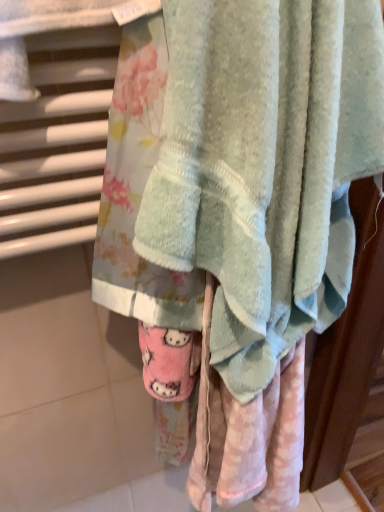
The width and height of the screenshot is (384, 512). What do you see at coordinates (265, 166) in the screenshot?
I see `soft pastel towel at center` at bounding box center [265, 166].

Image resolution: width=384 pixels, height=512 pixels. Identify the location of soft pastel towel at center. (265, 166).

This screenshot has width=384, height=512. Find the location of `soft pastel towel at center`. soft pastel towel at center is located at coordinates (265, 166).